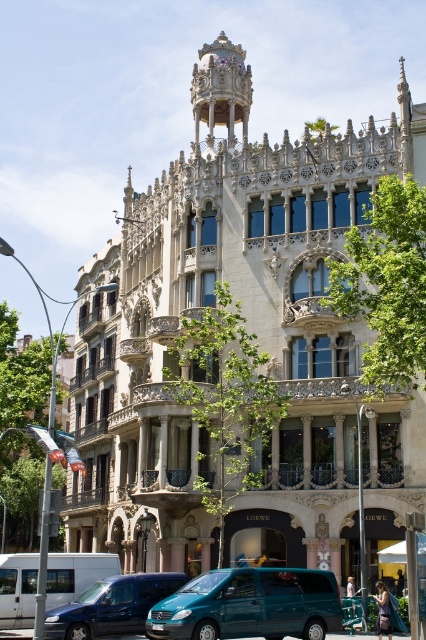
The image size is (426, 640). Describe the element at coordinates (250, 605) in the screenshot. I see `teal matte van at center` at that location.

Does teal matte van at center have a smaller size compared to teal matte van at lower left?

Actually, teal matte van at center might be larger than teal matte van at lower left.

Between point (293, 595) and point (150, 598), which one is positioned in front?

Point (293, 595)

This screenshot has width=426, height=640. Find the location of `teal matte van at center`. teal matte van at center is located at coordinates (250, 605).